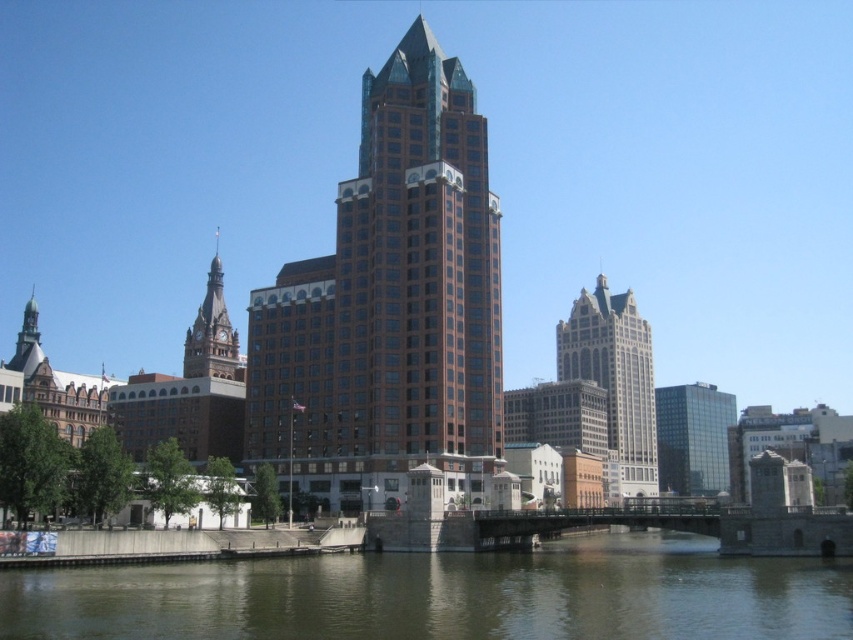
Is brown glassy building at center shorter than glassy reflective building at right?

No, brown glassy building at center is not shorter than glassy reflective building at right.

This screenshot has width=853, height=640. In order to click on brown glassy building at center in this screenshot , I will do `click(390, 291)`.

Which is in front, point (344, 305) or point (688, 417)?

Point (344, 305)

Locate an element on the screen. This screenshot has height=640, width=853. brown glassy building at center is located at coordinates (390, 291).

Is brown glassy building at center above brick steeple at left?

Actually, brown glassy building at center is below brick steeple at left.

Does brown glassy building at center appear on the right side of brick steeple at left?

Correct, you'll find brown glassy building at center to the right of brick steeple at left.

Identify the location of brown glassy building at center. (390, 291).

Find the location of `brown glassy building at center`. brown glassy building at center is located at coordinates (390, 291).

Does brown glassy building at center come in front of brown murky water at lower center?

That is False.

What do you see at coordinates (390, 291) in the screenshot? I see `brown glassy building at center` at bounding box center [390, 291].

Is point (463, 346) farther from viewer compared to point (189, 577)?

Yes.

Locate an element on the screen. This screenshot has height=640, width=853. brown glassy building at center is located at coordinates (390, 291).